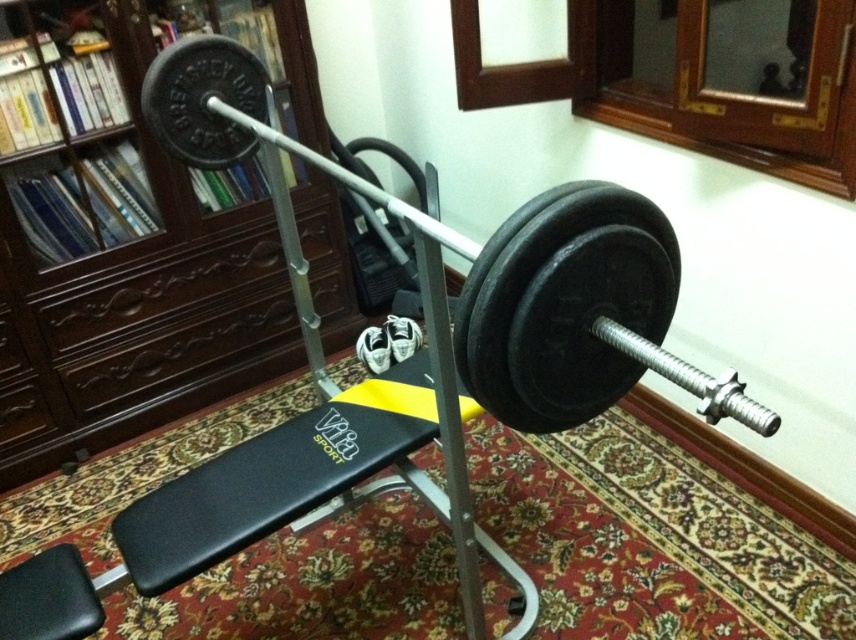
Based on the photo, you are setting up a home gym and need to place the dark wood bookshelf at upper left and the black rubber barbell at center. Since you want to maximize space, which object should you place closer to the wall to save space?

The black rubber barbell at center is smaller than the dark wood bookshelf at upper left, so placing the dark wood bookshelf at upper left closer to the wall would save more space because it takes up more room.

You are setting up a home gym and need to place the dark wood bookshelf at upper left and the black rubber barbell at center. Given their sizes, which one can fit through a doorway that is 30 cm thick?

The dark wood bookshelf at upper left is thinner than the black rubber barbell at center, so the dark wood bookshelf at upper left can fit through the 30 cm thick doorway if its thickness is less than 30 cm, while the black rubber barbell at center might not fit due to its greater thickness.

In the scene shown: You are setting up a home gym and need to place the Vita Sport bench on the patterned red carpet. The bench requires a clear space of 2 meters in length. Given the dark wood bookshelf at upper left is at coordinates point 0.367, 0.155, can you determine if there is enough space on the carpet for the bench?

The dark wood bookshelf at upper left is located at point (132, 234), so the bench can be placed on the carpet as there is sufficient space since the coordinates indicate the bookshelf is positioned away from the main area where the bench would be placed, allowing for the required 2 meters of clear space.